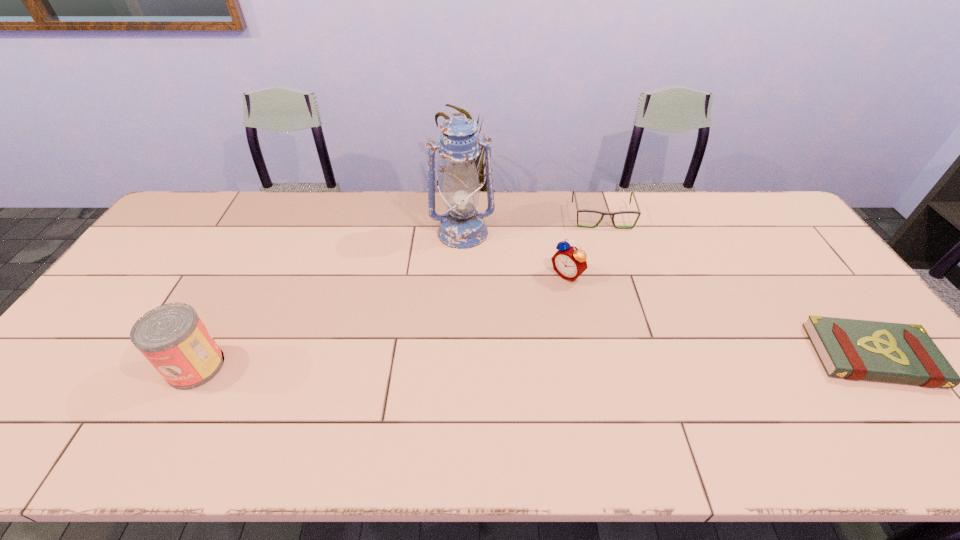
This screenshot has width=960, height=540. Find the location of `can`. can is located at coordinates (172, 337).

I want to click on the leftmost object, so click(172, 337).

At what (x,y) coordinates should I click in order to perform the action: click on the rightmost object. Please return your answer as a coordinate pair (x, y). Image resolution: width=960 pixels, height=540 pixels. Looking at the image, I should click on (852, 349).

Locate an element on the screen. book is located at coordinates (852, 349).

The width and height of the screenshot is (960, 540). I want to click on the fourth object from left to right, so click(638, 212).

You are a GUI agent. You are given a task and a screenshot of the screen. Output one action in this format:
    pyautogui.click(x=<x>, y=<y>)
    Task: Click on the spectacles
    The width and height of the screenshot is (960, 540).
    Given the screenshot: What is the action you would take?
    pyautogui.click(x=638, y=212)

I want to click on the third farthest object, so click(x=569, y=262).

Identify the location of the third object from left to right. Image resolution: width=960 pixels, height=540 pixels. click(569, 262).

Locate an element on the screen. The image size is (960, 540). the tallest object is located at coordinates (462, 227).

The width and height of the screenshot is (960, 540). In order to click on lantern in this screenshot , I will do `click(462, 227)`.